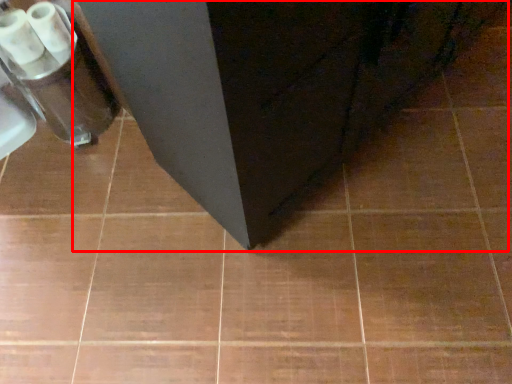
Question: From the image's perspective, what is the correct spatial relationship of furniture (annotated by the red box) in relation to toilet paper?

Choices:
 (A) above
 (B) below

Answer: (A)